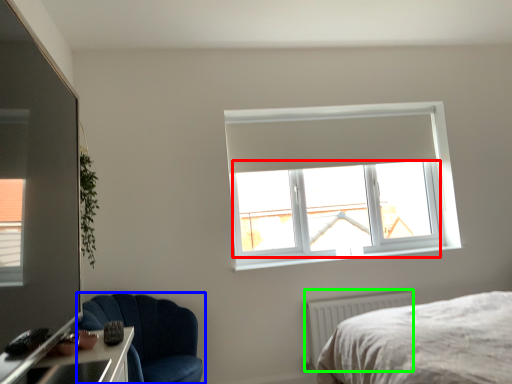
Question: Based on their relative distances, which object is nearer to window screen (highlighted by a red box)? Choose from chair (highlighted by a blue box) and radiator (highlighted by a green box).

Choices:
 (A) chair
 (B) radiator

Answer: (B)